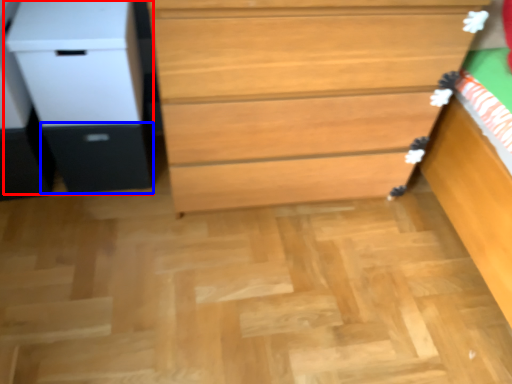
Question: Which of the following is the closest to the observer, file cabinet (highlighted by a red box) or drawer (highlighted by a blue box)?

Choices:
 (A) file cabinet
 (B) drawer

Answer: (A)